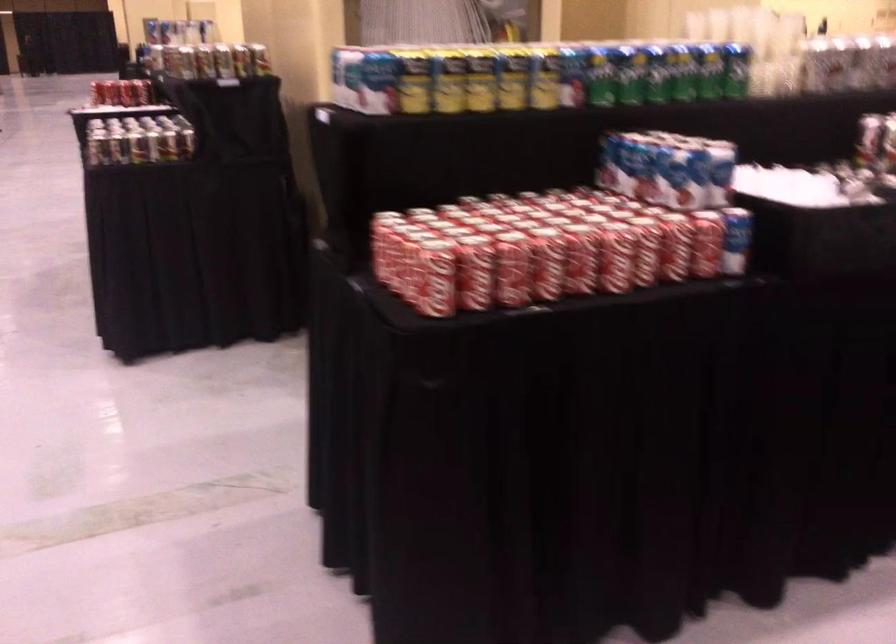
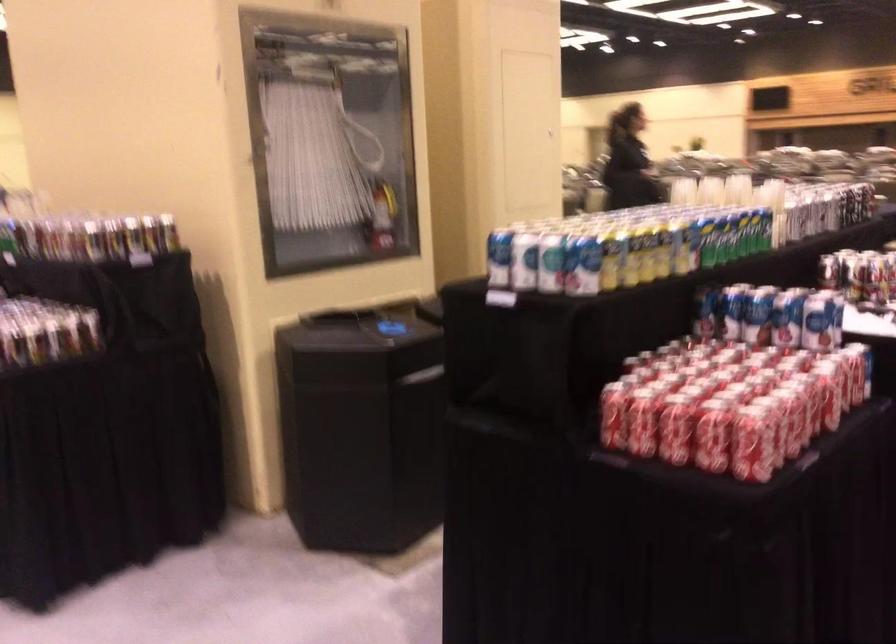
Find the pixel in the second image that matches point (580, 70) in the first image.

(703, 239)